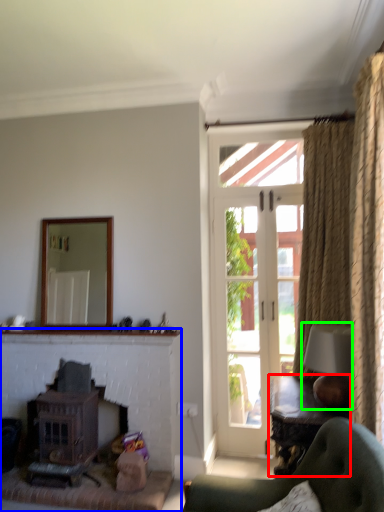
Question: Estimate the real-world distances between objects in this image. Which object is farther from table (highlighted by a red box), fireplace (highlighted by a blue box) or lamp (highlighted by a green box)?

Choices:
 (A) fireplace
 (B) lamp

Answer: (A)